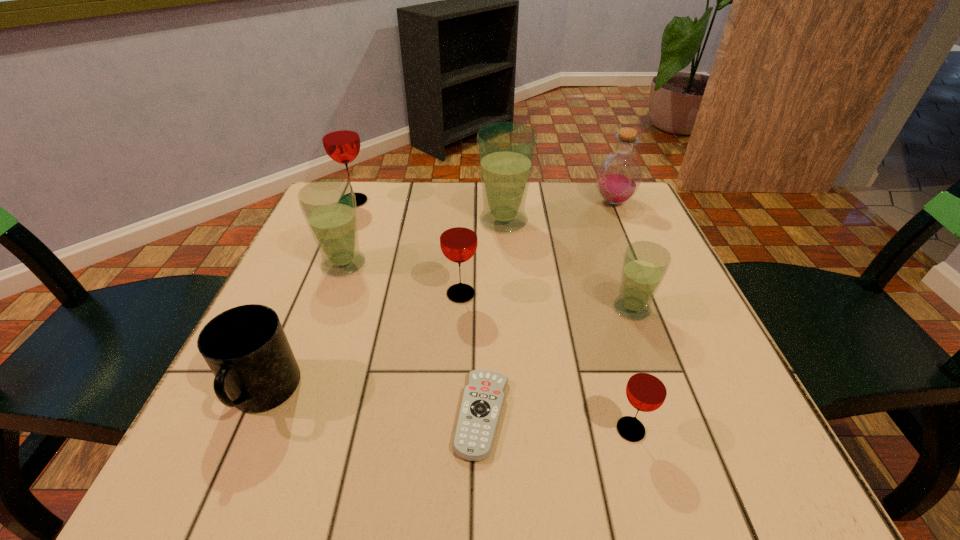
The image size is (960, 540). Find the location of `the rightmost blue glass`. the rightmost blue glass is located at coordinates (645, 264).

Where is `the rightmost red glass`? the rightmost red glass is located at coordinates (x=646, y=390).

Locate an element on the screen. The image size is (960, 540). the seventh object from left to right is located at coordinates (646, 390).

The image size is (960, 540). I want to click on black mug, so click(246, 348).

This screenshot has width=960, height=540. Identify the location of the shortest object. (483, 398).

The width and height of the screenshot is (960, 540). I want to click on vacant space located on the right of the farthest red glass, so click(440, 201).

This screenshot has height=540, width=960. What are the coordinates of `free region located on the left of the farthest blue glass` in the screenshot? It's located at click(399, 221).

You are a GUI agent. You are given a task and a screenshot of the screen. Output one action in this format:
    pyautogui.click(x=<x>, y=<y>)
    Task: Click on the free spot located 0.310m on the left of the bottle
    The height and width of the screenshot is (540, 960).
    Given the screenshot: What is the action you would take?
    pyautogui.click(x=472, y=202)

Locate an element on the screen. This screenshot has width=960, height=540. vacant point located 0.380m on the back of the second farthest red glass is located at coordinates (466, 190).

Find the location of `vacant point located on the front of the leftmost blue glass`. vacant point located on the front of the leftmost blue glass is located at coordinates point(326,311).